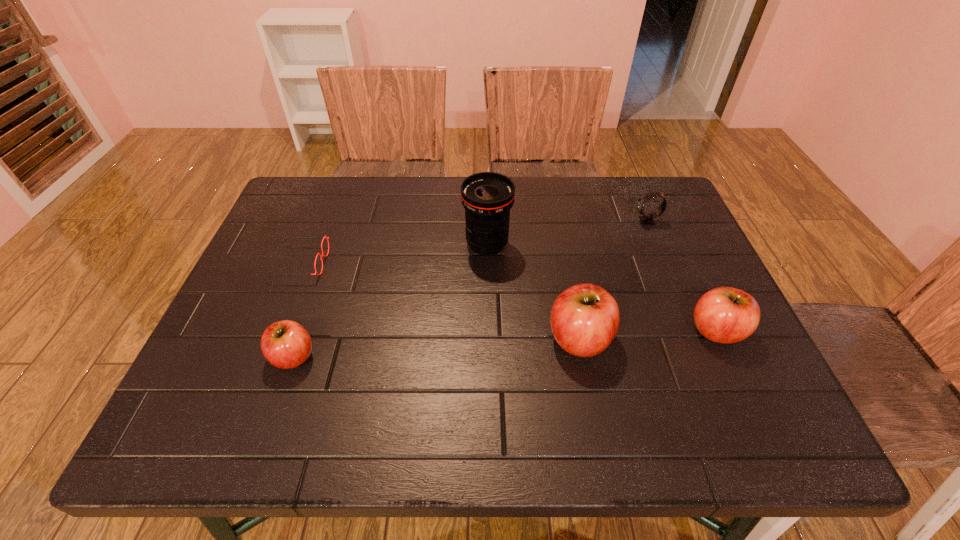
This screenshot has width=960, height=540. In order to click on vacant position located 0.310m on the left of the tallest apple in this screenshot , I will do `click(404, 339)`.

Image resolution: width=960 pixels, height=540 pixels. Identify the location of free spot located 0.200m on the back of the rightmost apple. (680, 251).

At what (x,y) coordinates should I click in order to perform the action: click on free location located on the face of the watch. Please return your answer as a coordinate pair (x, y). This screenshot has width=960, height=540. Looking at the image, I should click on (495, 221).

Find the location of a particular element. vacant space located on the face of the watch is located at coordinates click(595, 221).

What are the coordinates of `blank space located on the face of the watch` in the screenshot? It's located at (584, 221).

Identify the location of vacant space located on the front-facing side of the shortest object. This screenshot has width=960, height=540. tap(420, 263).

Identify the location of blank space located 0.150m on the front of the tallest object. (488, 306).

Identify the location of object situated at the far edge. (647, 219).

This screenshot has width=960, height=540. Identify the location of apple that is at the left edge. [286, 344].

You are a GUI agent. You are given a task and a screenshot of the screen. Output one action in this format:
    pyautogui.click(x=<x>, y=<y>)
    Task: Click on the spectacles positioned at the left edge
    This screenshot has width=960, height=540.
    Given the screenshot: What is the action you would take?
    pyautogui.click(x=324, y=236)